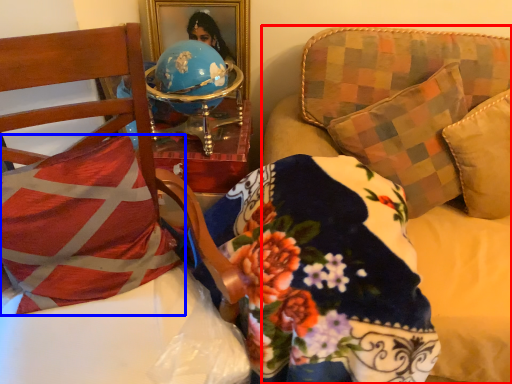
Question: Among these objects, which one is farthest to the camera, studio couch (highlighted by a red box) or pillow (highlighted by a blue box)?

Choices:
 (A) studio couch
 (B) pillow

Answer: (B)